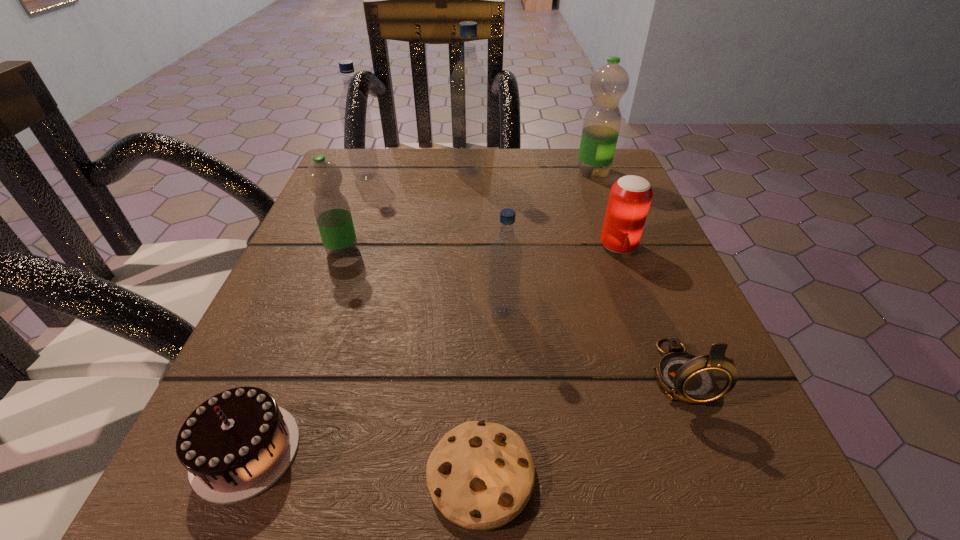
Where is `free spot between the biggest blue water bottle and the second shortest object`? free spot between the biggest blue water bottle and the second shortest object is located at coordinates (358, 311).

Where is `unoccupied area between the eighth tallest object and the tallest water bottle`? unoccupied area between the eighth tallest object and the tallest water bottle is located at coordinates (358, 311).

Where is `vacant area that lies between the tallest water bottle and the chocolate cake`? vacant area that lies between the tallest water bottle and the chocolate cake is located at coordinates (358, 311).

At what (x,y) coordinates should I click in order to perform the action: click on vacant region between the compass and the right green water bottle. Please return your answer as a coordinate pair (x, y). The height and width of the screenshot is (540, 960). Looking at the image, I should click on (636, 272).

Where is `free spot between the nearer green water bottle and the smallest blue water bottle`? The height and width of the screenshot is (540, 960). free spot between the nearer green water bottle and the smallest blue water bottle is located at coordinates (422, 281).

I want to click on empty space that is in between the compass and the rightmost water bottle, so click(636, 272).

Where is `vacant area that lies between the rightmost water bottle and the fourth farthest water bottle`? Image resolution: width=960 pixels, height=540 pixels. vacant area that lies between the rightmost water bottle and the fourth farthest water bottle is located at coordinates (468, 211).

Identify the location of empty location between the rightmost water bottle and the third shortest object. (636, 272).

In order to click on object that ranks as the fifth closest to the tallest water bottle in this screenshot , I will do `click(505, 254)`.

What are the coordinates of `object identified as the fourth closest to the second smallest blue water bottle` in the screenshot? It's located at (608, 84).